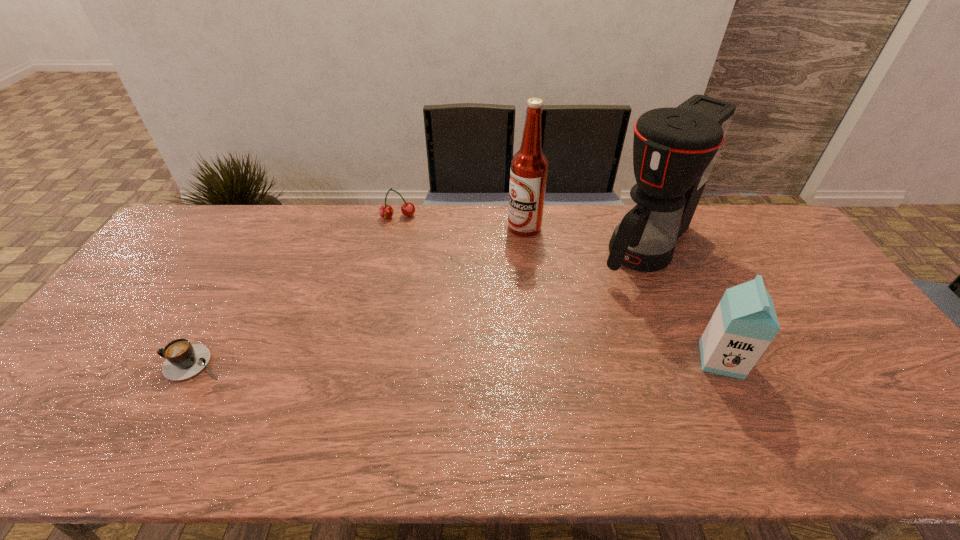
Identify the location of vacant space located 0.230m on the right of the milk carton. tap(833, 360).

Identify the location of vacant space located 0.150m with stems pointing upwards on the cherry. (400, 249).

Where is `free spot located with stems pointing upwards on the cherry`? free spot located with stems pointing upwards on the cherry is located at coordinates (401, 293).

Where is `blank space located 0.200m with stems pointing upwards on the cherry`? blank space located 0.200m with stems pointing upwards on the cherry is located at coordinates pos(400,260).

At what (x,y) coordinates should I click in order to perform the action: click on vacant space located 0.140m on the label side of the alcohol. Please return your answer as a coordinate pair (x, y). Image resolution: width=960 pixels, height=540 pixels. Looking at the image, I should click on (492, 258).

At what (x,y) coordinates should I click in order to perform the action: click on free region located 0.390m on the label side of the alcohol. Please return your answer as a coordinate pair (x, y). Looking at the image, I should click on (443, 305).

Find the location of a particular element. The image size is (960, 540). vacant space located 0.080m on the label side of the alcohol is located at coordinates coord(502,248).

You are a GUI agent. You are given a task and a screenshot of the screen. Output one action in this format:
    pyautogui.click(x=<x>, y=<y>)
    Task: Click on the vacant area situated pour from the carafe of the coffee maker
    This screenshot has width=960, height=540.
    Given the screenshot: What is the action you would take?
    pyautogui.click(x=585, y=308)

The image size is (960, 540). Find the location of `vacant point located pour from the carafe of the coffee maker`. vacant point located pour from the carafe of the coffee maker is located at coordinates tap(545, 348).

This screenshot has height=540, width=960. Identify the location of blank area located pour from the carafe of the coffee maker. (549, 343).